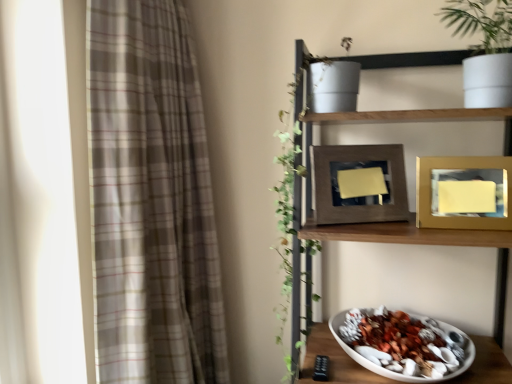
Question: Which is correct: wooden frame at center, arranged as the second picture frame when viewed from the right, is inside plaid fabric curtain at left, or outside of it?

Choices:
 (A) inside
 (B) outside

Answer: (B)

Question: Based on their positions, is wooden frame at center, arranged as the second picture frame when viewed from the right, located to the left or right of plaid fabric curtain at left?

Choices:
 (A) right
 (B) left

Answer: (A)

Question: Estimate the real-world distances between objects in this image. Which object is closer to the wooden frame at center, arranged as the second picture frame when viewed from the right?

Choices:
 (A) gold metallic picture frame at upper right, which ranks as the 1th picture frame in right-to-left order
 (B) plaid fabric curtain at left
 (C) wooden shelf at upper right
 (D) white matte bowl at lower right

Answer: (C)

Question: Estimate the real-world distances between objects in this image. Which object is farther from the white matte bowl at lower right?

Choices:
 (A) plaid fabric curtain at left
 (B) gold metallic picture frame at upper right, which is the second picture frame in left-to-right order
 (C) wooden shelf at upper right
 (D) wooden frame at center, arranged as the second picture frame when viewed from the right

Answer: (A)